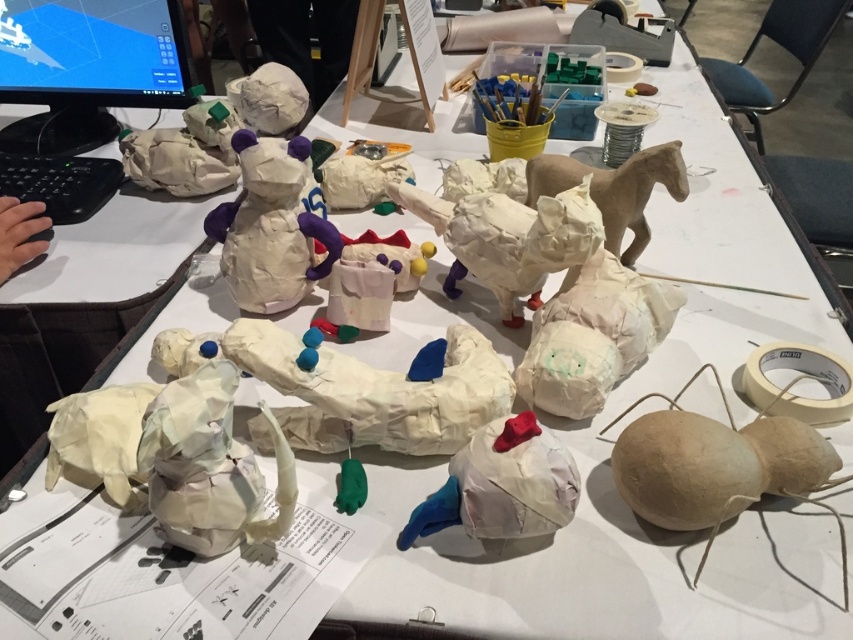
Can you confirm if matte brown spider at lower right is smaller than white paper mache animal at center?

No.

Who is positioned more to the left, matte brown spider at lower right or white paper mache animal at center?

Positioned to the left is white paper mache animal at center.

Between point (776, 493) and point (628, 321), which one is positioned behind?

Point (628, 321)

Where is `matte brown spider at lower right`? This screenshot has height=640, width=853. matte brown spider at lower right is located at coordinates (717, 467).

Who is more distant from viewer, (653, 305) or (630, 193)?

Point (630, 193)

Who is lower down, white paper mache animal at center or brown paper horse at upper right?

Positioned lower is white paper mache animal at center.

Between point (549, 346) and point (631, 253), which one is positioned behind?

The point (631, 253) is behind.

Locate an element on the screen. white paper mache animal at center is located at coordinates (595, 336).

Is white crumpled paper at center taller than brown paper horse at upper right?

No.

Describe the element at coordinates (502, 484) in the screenshot. I see `white crumpled paper at center` at that location.

Locate an element on the screen. white crumpled paper at center is located at coordinates (502, 484).